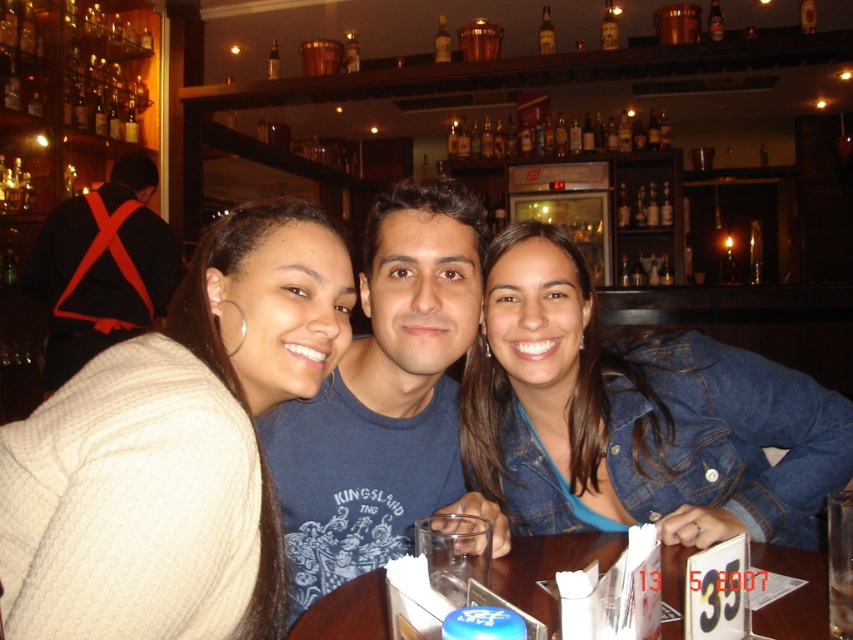
Question: Is blue cotton shirt at center wider than denim jacket at lower right?

Choices:
 (A) no
 (B) yes

Answer: (B)

Question: Does blue cotton t-shirt at center have a lesser width compared to black leather backpack at upper left?

Choices:
 (A) no
 (B) yes

Answer: (B)

Question: Which point is closer to the camera taking this photo?

Choices:
 (A) (540, 40)
 (B) (682, 589)
 (C) (474, 208)
 (D) (144, 236)

Answer: (B)

Question: Considering the real-world distances, which object is farthest from the clear glass at center?

Choices:
 (A) translucent glass bottle at upper center
 (B) amber glass bottle at upper center
 (C) denim jacket at lower right
 (D) black leather backpack at upper left

Answer: (A)

Question: Which object appears farthest from the camera in this image?

Choices:
 (A) denim jacket at lower right
 (B) white knitted sweater at left
 (C) clear plastic glass at center

Answer: (A)

Question: Can you confirm if blue cotton t-shirt at center is smaller than clear glass at center?

Choices:
 (A) yes
 (B) no

Answer: (B)